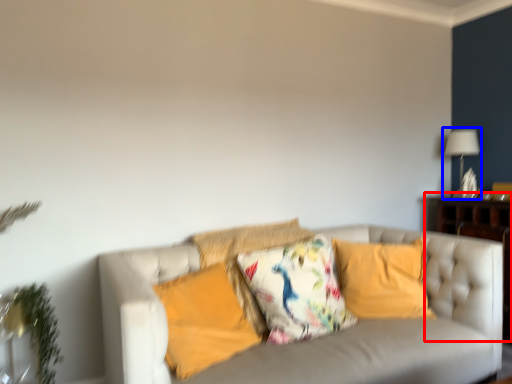
Question: Among these objects, which one is farthest to the camera, dresser (highlighted by a red box) or table lamp (highlighted by a blue box)?

Choices:
 (A) dresser
 (B) table lamp

Answer: (B)